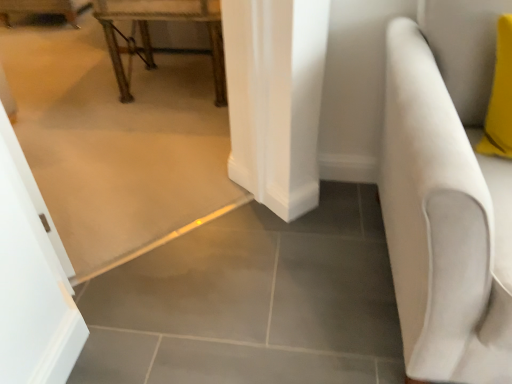
What do you see at coordinates (443, 224) in the screenshot? The height and width of the screenshot is (384, 512). I see `white fabric armchair at right` at bounding box center [443, 224].

In order to click on white fabric armchair at right in this screenshot , I will do `click(443, 224)`.

The height and width of the screenshot is (384, 512). Describe the element at coordinates (149, 35) in the screenshot. I see `metallic gold table at upper left` at that location.

Find the location of a particular element. The width and height of the screenshot is (512, 384). metallic gold table at upper left is located at coordinates (149, 35).

Locate an element on the screen. white fabric armchair at right is located at coordinates (443, 224).

Considering the relative positions of metallic gold table at upper left and white fabric armchair at right in the image provided, is metallic gold table at upper left to the right of white fabric armchair at right from the viewer's perspective?

Incorrect, metallic gold table at upper left is not on the right side of white fabric armchair at right.

Which object is further away from the camera taking this photo, metallic gold table at upper left or white fabric armchair at right?

metallic gold table at upper left is further from the camera.

Which is farther, (209, 33) or (426, 287)?

The point (209, 33) is behind.

From the image's perspective, which is below, metallic gold table at upper left or white fabric armchair at right?

white fabric armchair at right is shown below in the image.

From a real-world perspective, who is located higher, metallic gold table at upper left or white fabric armchair at right?

In real-world perspective, white fabric armchair at right is above.

Considering the sizes of objects metallic gold table at upper left and white fabric armchair at right in the image provided, who is wider, metallic gold table at upper left or white fabric armchair at right?

white fabric armchair at right is wider.

Which of these two, metallic gold table at upper left or white fabric armchair at right, stands shorter?

With less height is metallic gold table at upper left.

In terms of size, does metallic gold table at upper left appear bigger or smaller than white fabric armchair at right?

Considering their sizes, metallic gold table at upper left takes up less space than white fabric armchair at right.

Is metallic gold table at upper left surrounding white fabric armchair at right?

That's incorrect, white fabric armchair at right is not inside metallic gold table at upper left.

Is there a large distance between metallic gold table at upper left and white fabric armchair at right?

Yes.

Based on the photo, is metallic gold table at upper left turned away from white fabric armchair at right?

metallic gold table at upper left is not turned away from white fabric armchair at right.

How many degrees apart are the facing directions of metallic gold table at upper left and white fabric armchair at right?

The facing directions of metallic gold table at upper left and white fabric armchair at right are 90.7 degrees apart.

Locate an element on the screen. The image size is (512, 384). furniture beneath the white fabric armchair at right (from a real-world perspective) is located at coordinates (149, 35).

Is white fabric armchair at right to the left of metallic gold table at upper left from the viewer's perspective?

In fact, white fabric armchair at right is to the right of metallic gold table at upper left.

Consider the image. Does white fabric armchair at right lie behind metallic gold table at upper left?

No, the depth of white fabric armchair at right is less than that of metallic gold table at upper left.

Considering the points (477, 377) and (99, 1), which point is behind, point (477, 377) or point (99, 1)?

Positioned behind is point (99, 1).

From the image's perspective, is white fabric armchair at right above or below metallic gold table at upper left?

white fabric armchair at right is situated lower than metallic gold table at upper left in the image.

From a real-world perspective, who is located higher, white fabric armchair at right or metallic gold table at upper left?

white fabric armchair at right, from a real-world perspective.

Which of these two, white fabric armchair at right or metallic gold table at upper left, is thinner?

With smaller width is metallic gold table at upper left.

From their relative heights in the image, would you say white fabric armchair at right is taller or shorter than metallic gold table at upper left?

white fabric armchair at right is taller than metallic gold table at upper left.

Considering the relative sizes of white fabric armchair at right and metallic gold table at upper left in the image provided, is white fabric armchair at right bigger than metallic gold table at upper left?

Yes.

Is white fabric armchair at right completely or partially outside of metallic gold table at upper left?

white fabric armchair at right is positioned outside metallic gold table at upper left.

Would you say white fabric armchair at right is a long distance from metallic gold table at upper left?

Indeed, white fabric armchair at right is not near metallic gold table at upper left.

Is white fabric armchair at right turned away from metallic gold table at upper left?

No, white fabric armchair at right is not facing the opposite direction of metallic gold table at upper left.

What's the angular difference between white fabric armchair at right and metallic gold table at upper left's facing directions?

The angle between the facing direction of white fabric armchair at right and the facing direction of metallic gold table at upper left is 90.7 degrees.

Identify the location of furniture behind the white fabric armchair at right. The image size is (512, 384). (149, 35).

Where is `armchair on the right side of metallic gold table at upper left`? Image resolution: width=512 pixels, height=384 pixels. armchair on the right side of metallic gold table at upper left is located at coordinates (443, 224).

Where is `furniture behind the white fabric armchair at right`? The height and width of the screenshot is (384, 512). furniture behind the white fabric armchair at right is located at coordinates (149, 35).